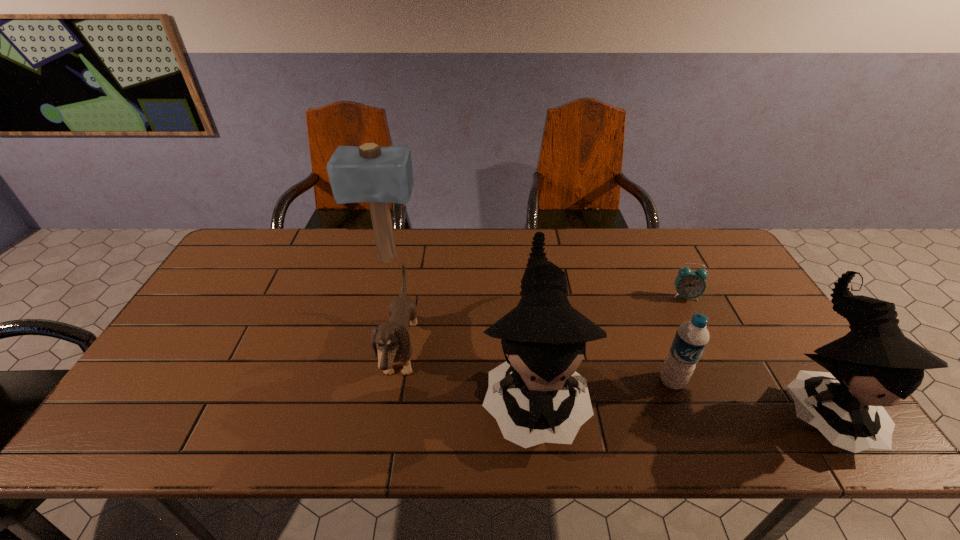
In the image, there is a desktop. At what (x,y) coordinates should I click in order to perform the action: click on vacant space at the left edge. Please return your answer as a coordinate pair (x, y). This screenshot has width=960, height=540. Looking at the image, I should click on (200, 367).

Identify the location of free region at the right edge of the desktop. (753, 295).

The image size is (960, 540). In order to click on free spot between the third tallest object and the alarm clock in this screenshot , I will do `click(752, 350)`.

This screenshot has height=540, width=960. Find the location of `unoccupied position between the taller doll and the farthest object`. unoccupied position between the taller doll and the farthest object is located at coordinates (460, 326).

Locate an element on the screen. This screenshot has width=960, height=540. free space between the left doll and the puppy is located at coordinates (468, 373).

You are a GUI agent. You are given a task and a screenshot of the screen. Output one action in this format:
    pyautogui.click(x=<x>, y=<y>)
    Task: Click on the vacant area that lies between the left doll and the farthest object
    This screenshot has height=540, width=960.
    Given the screenshot: What is the action you would take?
    pyautogui.click(x=460, y=326)

Identify which object is the closest to the third object from right to left. Please provide its 2D coordinates. Your answer should be formatted as a tuple, i.e. [(x, y)], where the tuple contains the x and y coordinates of a point satisfying the conditions above.

[(874, 365)]

Locate which object is the third closest to the third object from right to left. Please provide its 2D coordinates. Your answer should be formatted as a tuple, i.e. [(x, y)], where the tuple contains the x and y coordinates of a point satisfying the conditions above.

[(689, 284)]

Locate an element on the screen. This screenshot has height=540, width=960. free point that satisfies the following two spatial constraints: 1. on the face of the second object from right to left; 2. at the face of the fifth tallest object is located at coordinates (714, 353).

Find the location of a particular element. The image size is (960, 540). vacant space that satisfies the following two spatial constraints: 1. on the face of the second farthest object; 2. at the face of the second shortest object is located at coordinates (714, 353).